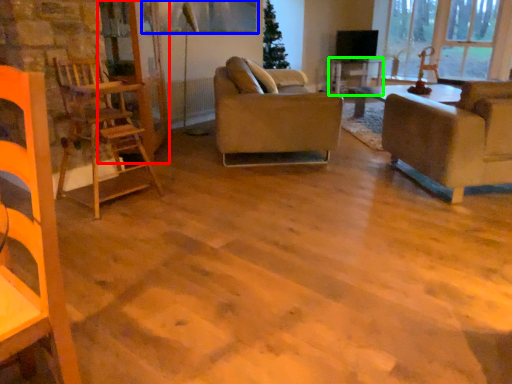
Question: Estimate the real-world distances between objects in this image. Which object is farther from glass door (highlighted by a red box), window screen (highlighted by a blue box) or table (highlighted by a green box)?

Choices:
 (A) window screen
 (B) table

Answer: (B)